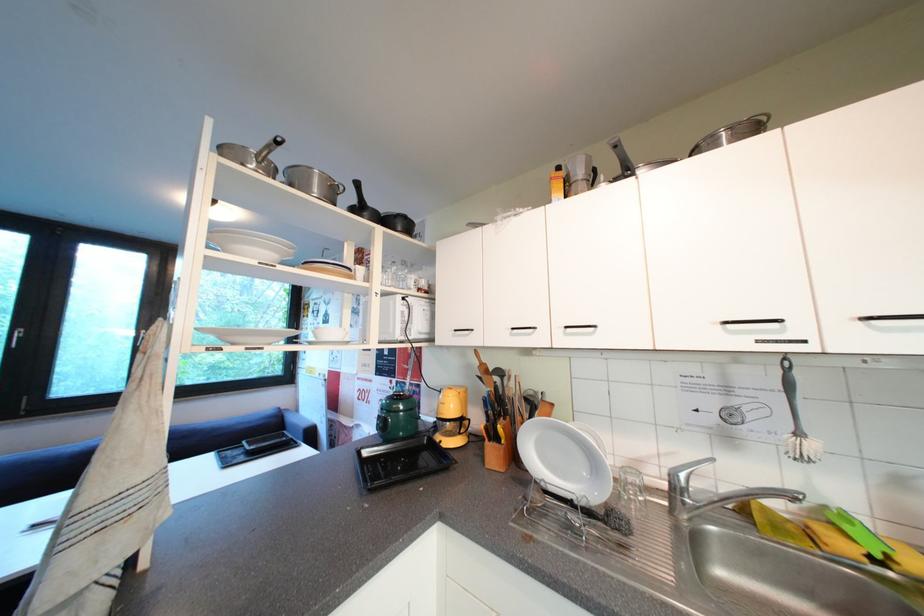
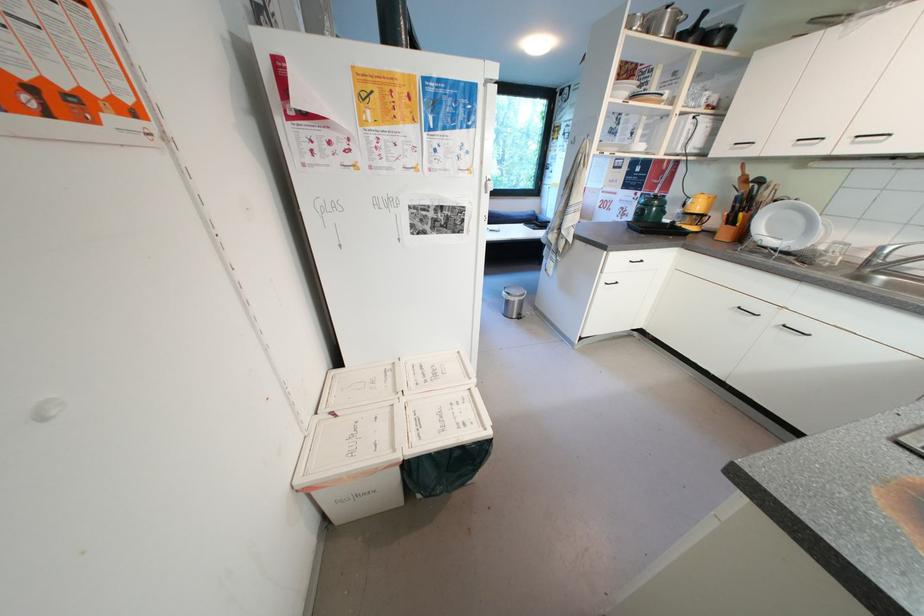
Find the pixel in the second image that matches point (359, 200) in the first image.

(697, 26)